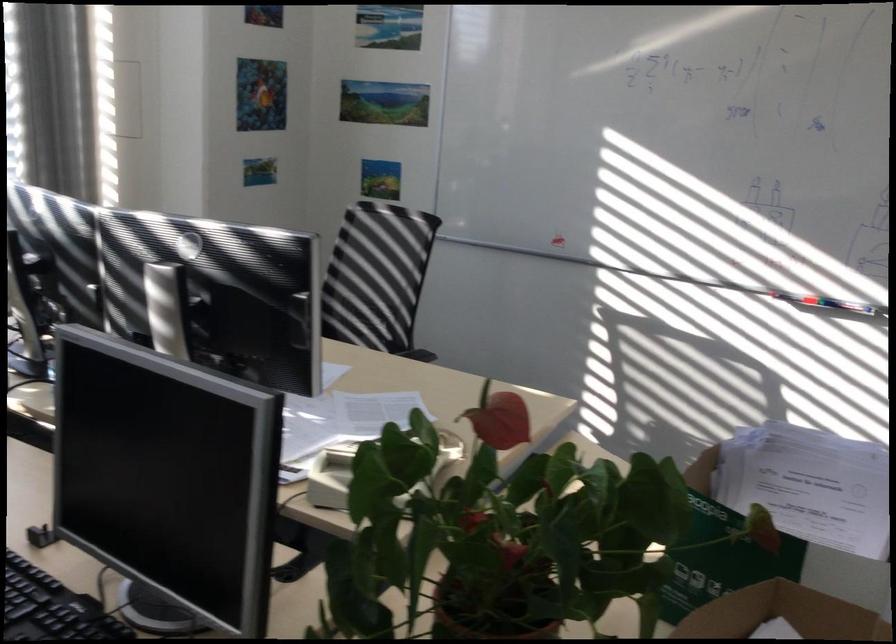
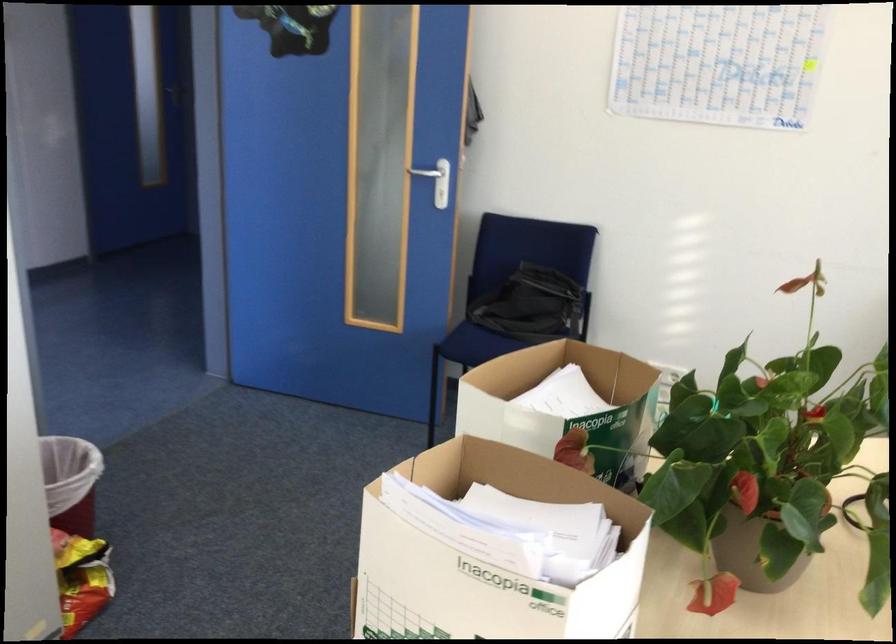
Where in the second image is the point corresponding to point 719,453 from the first image?

(489, 558)